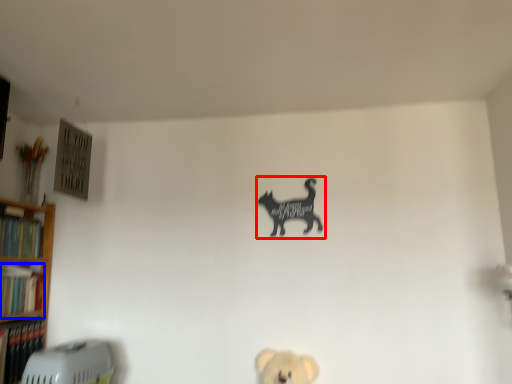
Question: Which point is further to the camera, animal (highlighted by a red box) or book (highlighted by a blue box)?

Choices:
 (A) animal
 (B) book

Answer: (A)